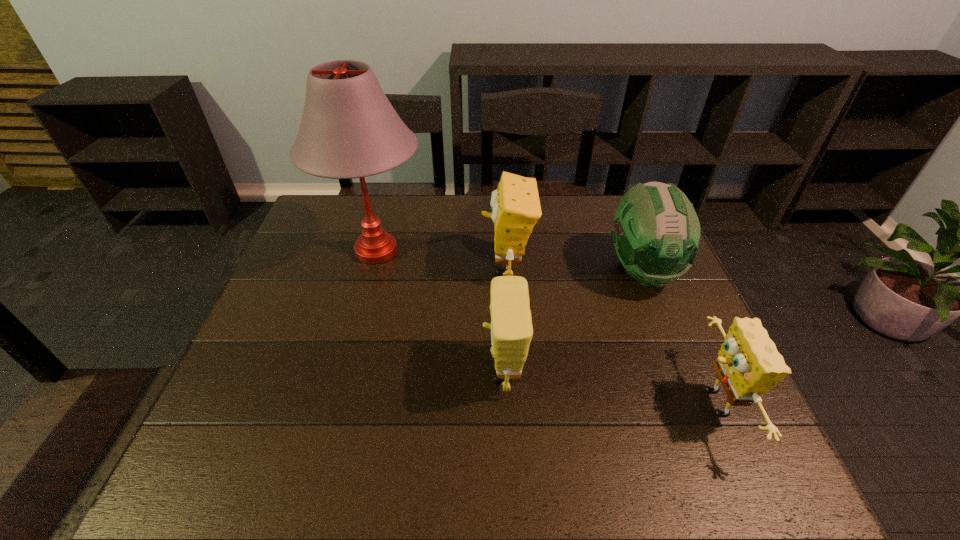
Find the location of a particular element. The width and height of the screenshot is (960, 540). vacant space at the far edge is located at coordinates (553, 225).

You are a GUI agent. You are given a task and a screenshot of the screen. Output one action in this format:
    pyautogui.click(x=<x>, y=<y>)
    Task: Click on the free space at the near edge of the desktop
    
    Given the screenshot: What is the action you would take?
    click(x=491, y=465)

At what (x,y) coordinates should I click in order to perform the action: click on vacant space at the left edge. Please return your answer as a coordinate pair (x, y). Looking at the image, I should click on (312, 264).

Locate an element on the screen. Image resolution: width=960 pixels, height=540 pixels. vacant area at the right edge is located at coordinates (671, 307).

Where is `free space at the far left corner`? This screenshot has height=540, width=960. free space at the far left corner is located at coordinates (345, 224).

The image size is (960, 540). Find the location of `vacant space that's between the rightmost sponge and the farthest sponge`. vacant space that's between the rightmost sponge and the farthest sponge is located at coordinates (610, 334).

You are a GUI agent. You are given a task and a screenshot of the screen. Output one action in this format:
    pyautogui.click(x=<x>, y=<y>)
    Task: Click on the free spot between the football helmet and the rightmost sponge
    
    Given the screenshot: What is the action you would take?
    pyautogui.click(x=678, y=337)

Locate an element on the screen. The width and height of the screenshot is (960, 540). vacant point located between the leftmost object and the farthest sponge is located at coordinates (442, 258).

Identify the location of vacant area between the rightmost sponge and the table lamp. Image resolution: width=960 pixels, height=540 pixels. (544, 327).

Identify the location of vacant point located between the football helmet and the rightmost sponge. click(678, 337).